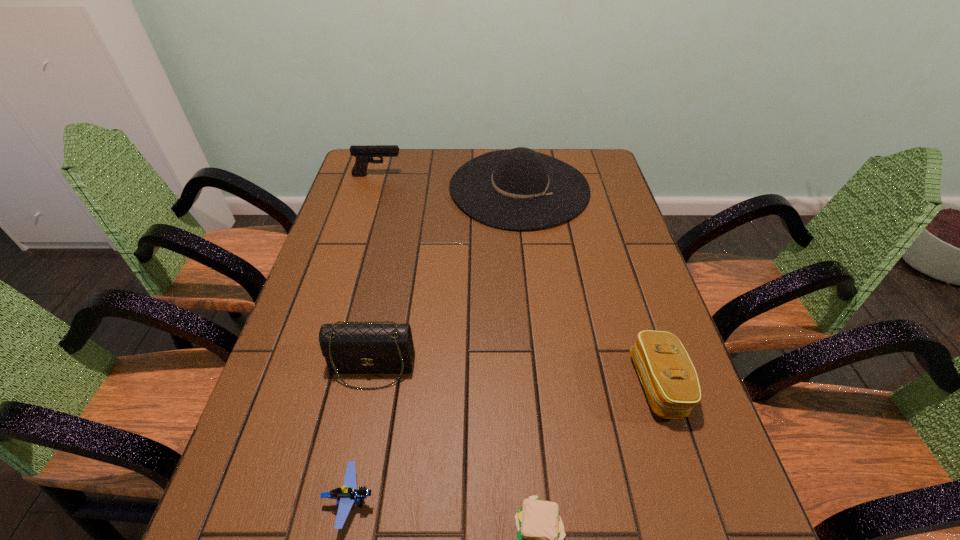
I want to click on object that is at the far left corner, so click(362, 153).

This screenshot has height=540, width=960. I want to click on object located at the far right corner, so click(516, 189).

In the image, there is a desktop. Identify the location of vacant space at the far edge. The height and width of the screenshot is (540, 960). [409, 165].

In order to click on vacant space at the left edge in this screenshot , I will do `click(307, 403)`.

Image resolution: width=960 pixels, height=540 pixels. In the image, there is a desktop. In order to click on vacant space at the right edge in this screenshot , I will do `click(612, 274)`.

I want to click on vacant space at the far right corner of the desktop, so [x=612, y=181].

Where is `vacant area that lies between the sombrero and the shorter clutch bag`? vacant area that lies between the sombrero and the shorter clutch bag is located at coordinates (588, 286).

Locate an element on the screen. vacant point located between the shorter clutch bag and the left clutch bag is located at coordinates (516, 376).

You are a GUI agent. You are given a task and a screenshot of the screen. Output one action in this format:
    pyautogui.click(x=<x>, y=<y>)
    Task: Click on the blank region between the second shortest object and the sombrero
    
    Given the screenshot: What is the action you would take?
    pyautogui.click(x=435, y=344)

The height and width of the screenshot is (540, 960). I want to click on vacant point located between the second shortest object and the shorter clutch bag, so click(x=504, y=442).